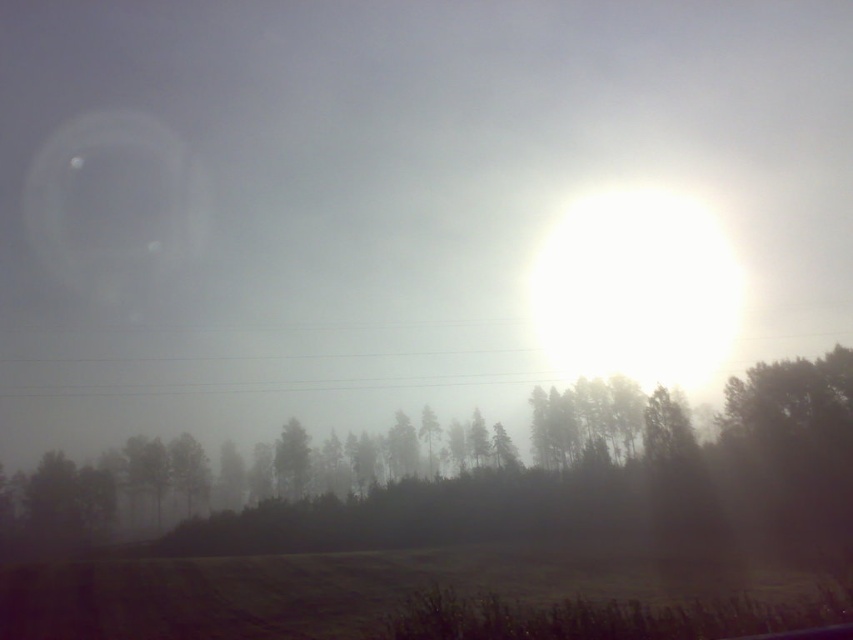
Which is in front, point (350, 518) or point (282, 448)?

Positioned in front is point (350, 518).

The width and height of the screenshot is (853, 640). Describe the element at coordinates (486, 476) in the screenshot. I see `silhouette/transparent tree at center` at that location.

At what (x,y) coordinates should I click in order to perform the action: click on silhouette/transparent tree at center. Please return your answer as a coordinate pair (x, y). The image size is (853, 640). Looking at the image, I should click on (486, 476).